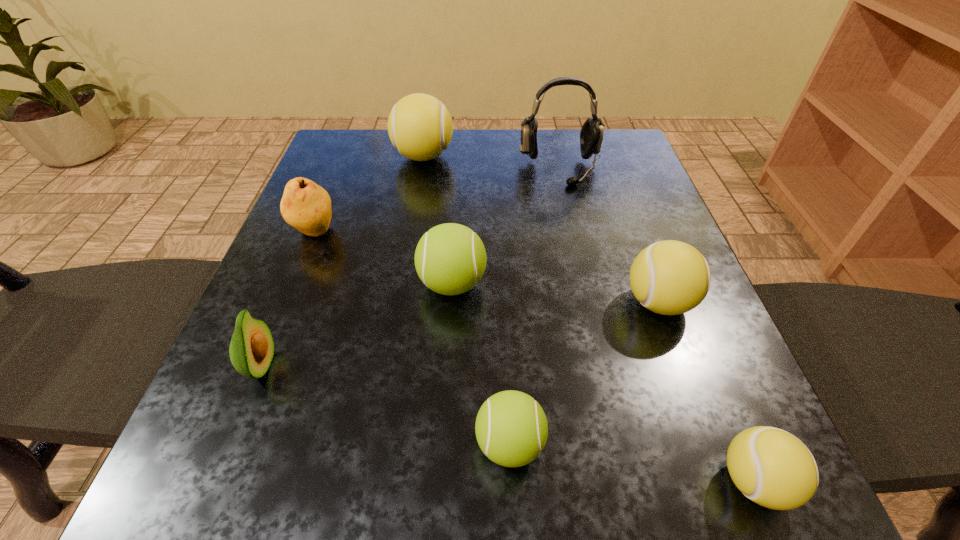
This screenshot has height=540, width=960. Identify the location of vacant space located 0.360m with the microphone on the side of the tallest object. (593, 315).

Where is `free location located on the front of the farthest tennis ball`? free location located on the front of the farthest tennis ball is located at coordinates (405, 268).

I want to click on free space located on the back of the pear, so click(x=353, y=137).

Locate an element on the screen. free space located 0.100m on the back of the farther green tennis ball is located at coordinates (456, 226).

Locate an element on the screen. free space located 0.360m on the left of the second farthest yellow tennis ball is located at coordinates (411, 302).

What are the coordinates of `free spot located 0.120m on the cut side of the green avocado` in the screenshot? It's located at (358, 367).

You are a GUI agent. You are given a task and a screenshot of the screen. Output one action in this format:
    pyautogui.click(x=<x>, y=<y>)
    Task: Click on the free spot located on the back of the smaller green tennis ball
    
    Given the screenshot: What is the action you would take?
    pyautogui.click(x=503, y=311)

At what (x,y) coordinates should I click in order to perform the action: click on free space located 0.120m on the left of the smallest yellow tennis ball. Please return your answer as a coordinate pair (x, y). The height and width of the screenshot is (540, 960). Looking at the image, I should click on (620, 481).

The image size is (960, 540). I want to click on headset that is at the far edge, so click(591, 135).

Identify the location of tennis ball positioned at the far edge. This screenshot has height=540, width=960. (420, 127).